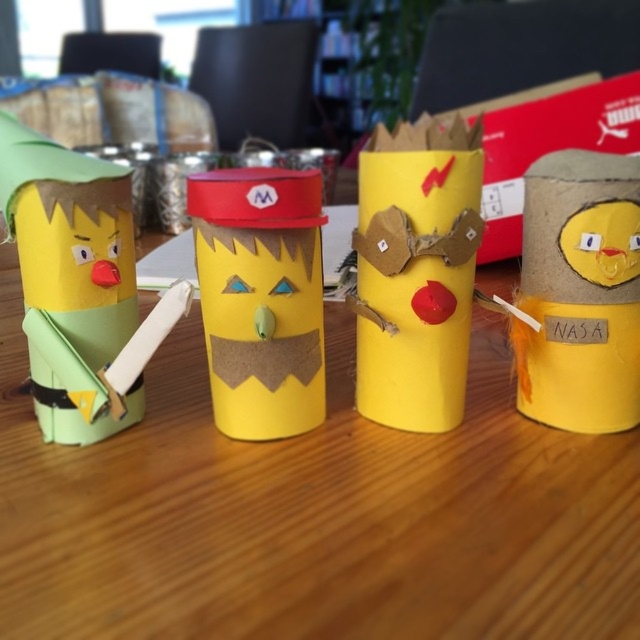
What is located at the coordinates point (260, 298)?

The yellow cardboard cup at center is located at point (260, 298).

You are organizing a craft fair and need to display two items on a shelf. The shelf has limited space. You have a yellow cardboard tubes at center and a yellow cardboard cup at center. Which item should you choose to place first if you want to ensure both items fit without overlapping?

The yellow cardboard cup at center should be placed first because it is smaller in size than the yellow cardboard tubes at center, allowing both items to fit on the shelf without overlapping.

Consider the image. You are organizing a craft fair and need to place two yellow cardboard tubes at center and yellow cardboard tube at right on a shelf. The shelf has a space of 10 inches between two brackets. Can you fit both items between the brackets without moving them?

The distance between yellow cardboard tubes at center and yellow cardboard tube at right is 10.26 inches, which is slightly longer than the 10 inch space between the brackets. Therefore, they cannot be placed between the brackets without moving them.